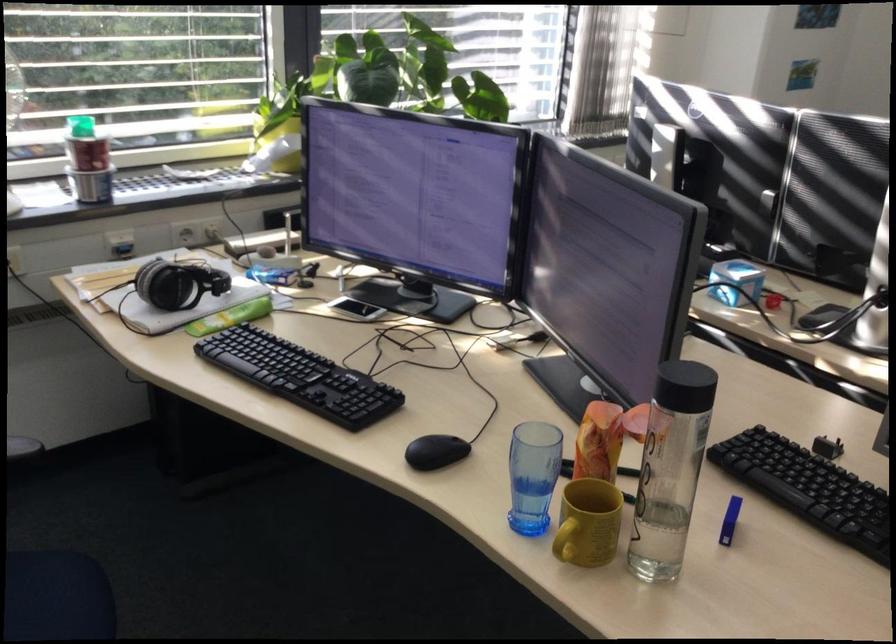
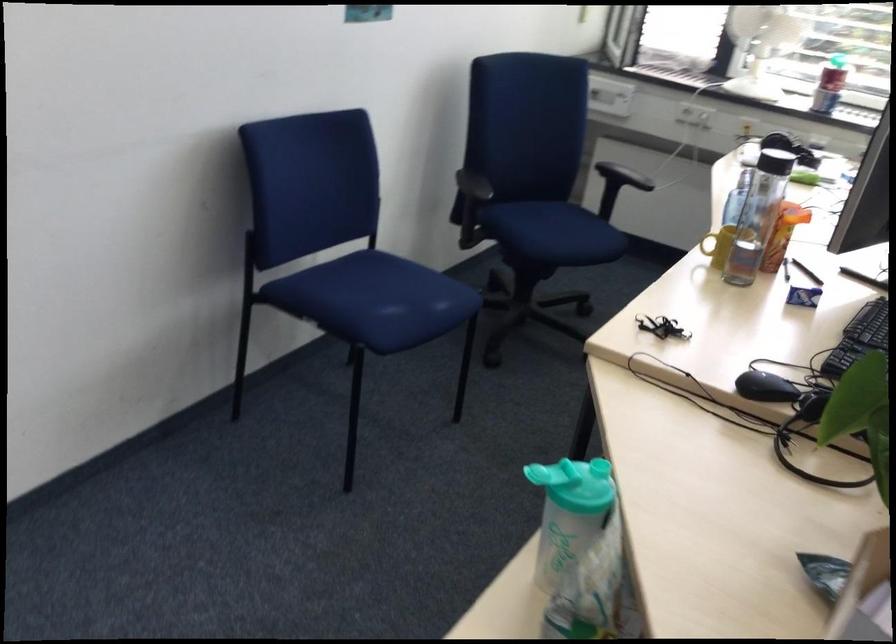
The point at (702,518) is marked in the first image. Where is the corresponding point in the second image?

(803, 297)